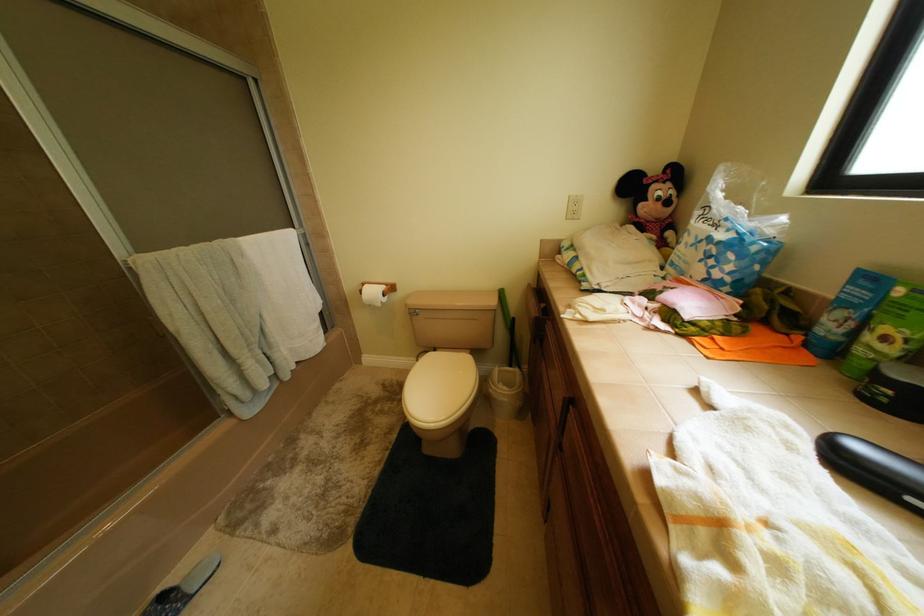
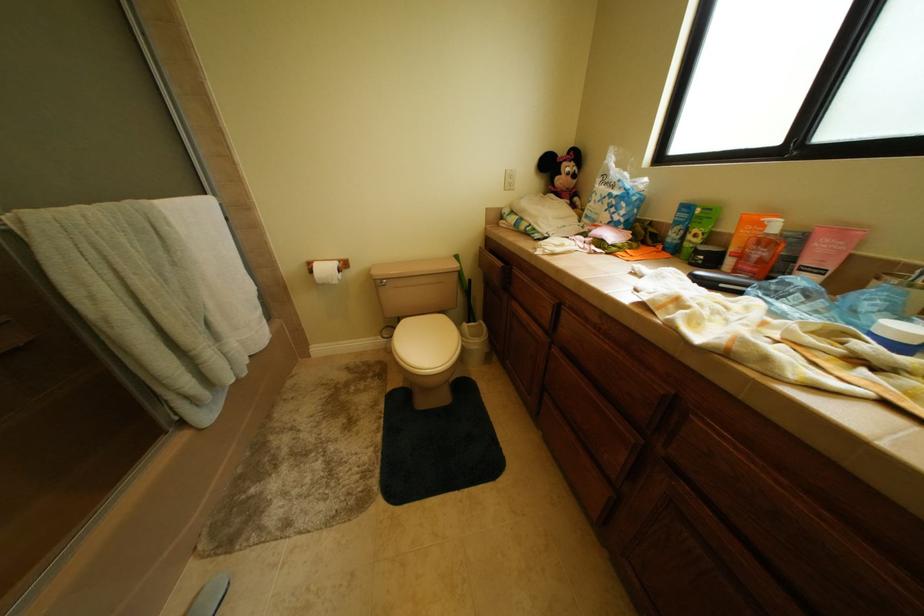
Question: Which direction would the cameraman need to move to produce the second image? Reply with the corresponding letter.

Choices:
 (A) Left
 (B) Right
 (C) Forward
 (D) Backward

Answer: (A)